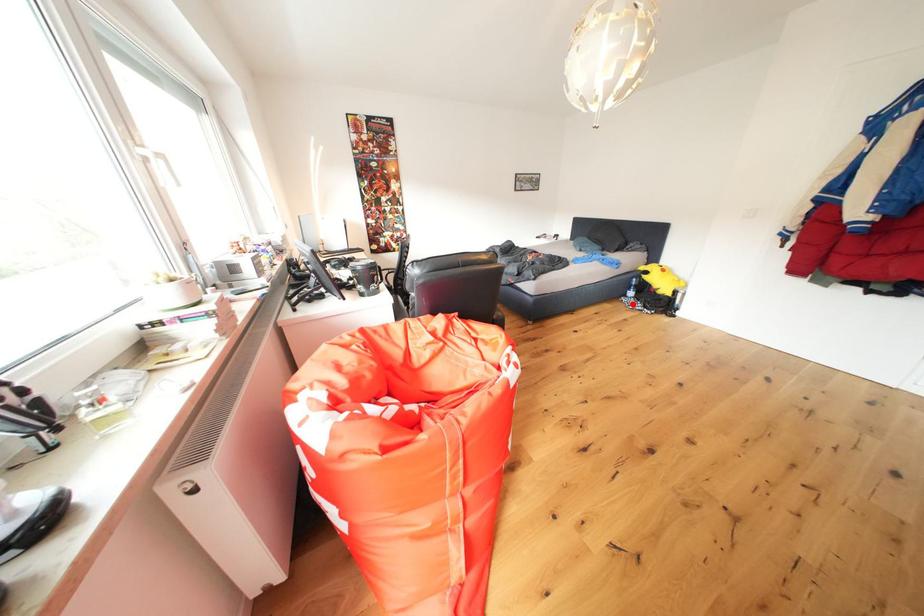
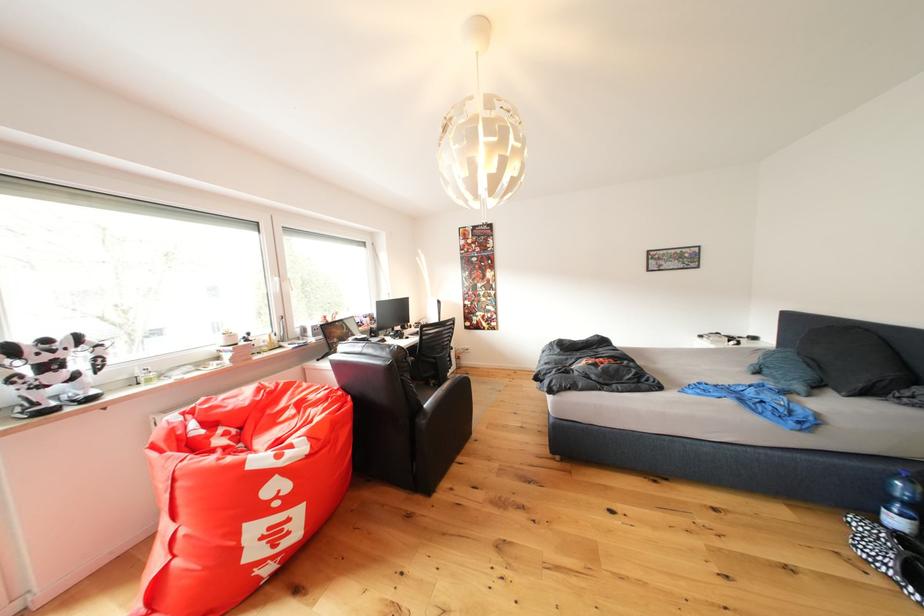
Find the pixel in the second image that matches the highlighted location in the first image.

(864, 527)